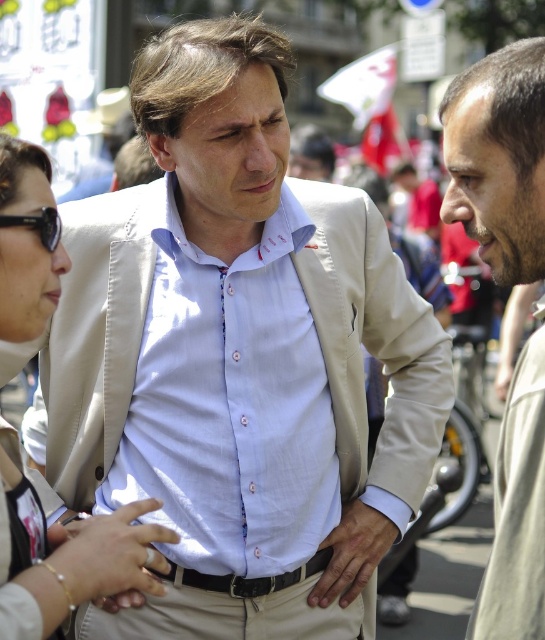
Does light blue cotton shirt at center lie behind matte beige vest at center?

Yes.

Which is behind, point (245, 285) or point (63, 608)?

Positioned behind is point (245, 285).

Who is more distant from viewer, (310, 522) or (147, 579)?

The point (310, 522) is behind.

Locate an element on the screen. The height and width of the screenshot is (640, 545). light blue cotton shirt at center is located at coordinates (229, 403).

Between beige textured jacket at right and gold bracelet at lower left, which one has more height?

beige textured jacket at right

Which is behind, point (479, 179) or point (146, 561)?

The point (479, 179) is more distant.

Image resolution: width=545 pixels, height=640 pixels. Identify the location of beige textured jacket at right. (499, 157).

The height and width of the screenshot is (640, 545). What are the coordinates of `beige textured jacket at right` in the screenshot? It's located at (499, 157).

Does light blue cotton shirt at center appear on the right side of black plastic sunglasses at left?

Indeed, light blue cotton shirt at center is positioned on the right side of black plastic sunglasses at left.

Is the position of light blue cotton shirt at center more distant than that of black plastic sunglasses at left?

Yes, it is.

At what (x,y) coordinates should I click in order to perform the action: click on light blue cotton shirt at center. Please return your answer as a coordinate pair (x, y). Looking at the image, I should click on (229, 403).